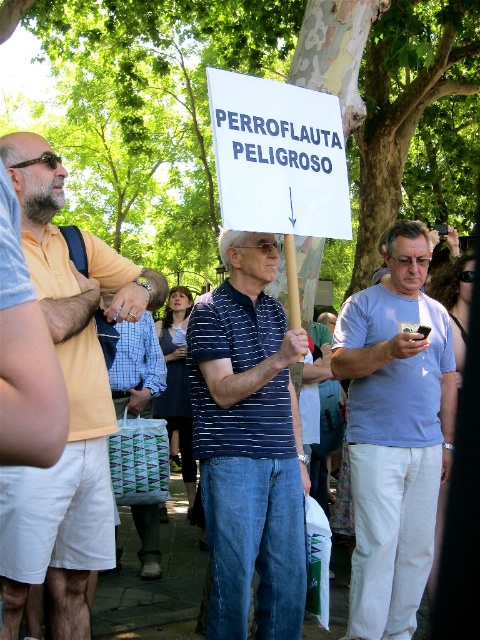
Question: Can you confirm if matte yellow shirt at left is wider than blue striped shirt at center?

Choices:
 (A) yes
 (B) no

Answer: (A)

Question: Does matte yellow shirt at left appear under light blue cotton shirt at center?

Choices:
 (A) no
 (B) yes

Answer: (A)

Question: From the image, what is the correct spatial relationship of matte yellow shirt at left in relation to light blue cotton shirt at center?

Choices:
 (A) right
 (B) left

Answer: (B)

Question: Which object appears farthest from the camera in this image?

Choices:
 (A) blue striped polo shirt at center
 (B) blue striped shirt at center
 (C) light blue cotton shirt at center

Answer: (B)

Question: Among these points, which one is nearest to the camera?

Choices:
 (A) (24, 499)
 (B) (123, 358)
 (C) (427, 316)

Answer: (A)

Question: Which point appears closest to the camera in this image?

Choices:
 (A) (115, 371)
 (B) (123, 284)
 (C) (256, 440)

Answer: (C)